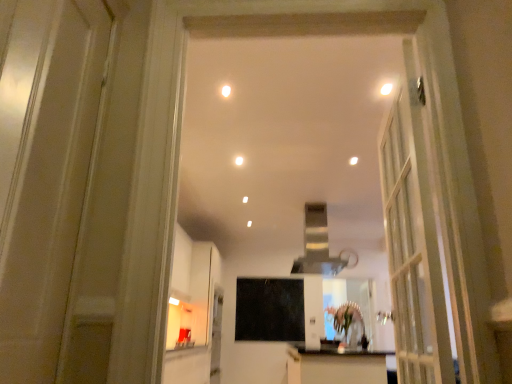
Question: Is green matte flower at center taller or shorter than clear glass mirror at center?

Choices:
 (A) tall
 (B) short

Answer: (B)

Question: In the image, is green matte flower at center on the left side or the right side of clear glass mirror at center?

Choices:
 (A) left
 (B) right

Answer: (A)

Question: Estimate the real-world distances between objects in this image. Which object is farther from the black matte screen door at center?

Choices:
 (A) green matte flower at center
 (B) white glossy light fixture at upper center, marked as the first lighting in a left-to-right arrangement
 (C) silver metallic exhaust hood at center
 (D) white glossy cabinet at lower center
 (E) clear glass mirror at center

Answer: (B)

Question: Which of these objects is positioned closest to the clear glass mirror at center?

Choices:
 (A) white glossy light fixture at upper center, placed as the second lighting when sorted from left to right
 (B) green matte flower at center
 (C) white glossy light fixture at upper center, marked as the first lighting in a left-to-right arrangement
 (D) white glossy cabinet at lower center
 (E) black matte screen door at center

Answer: (E)